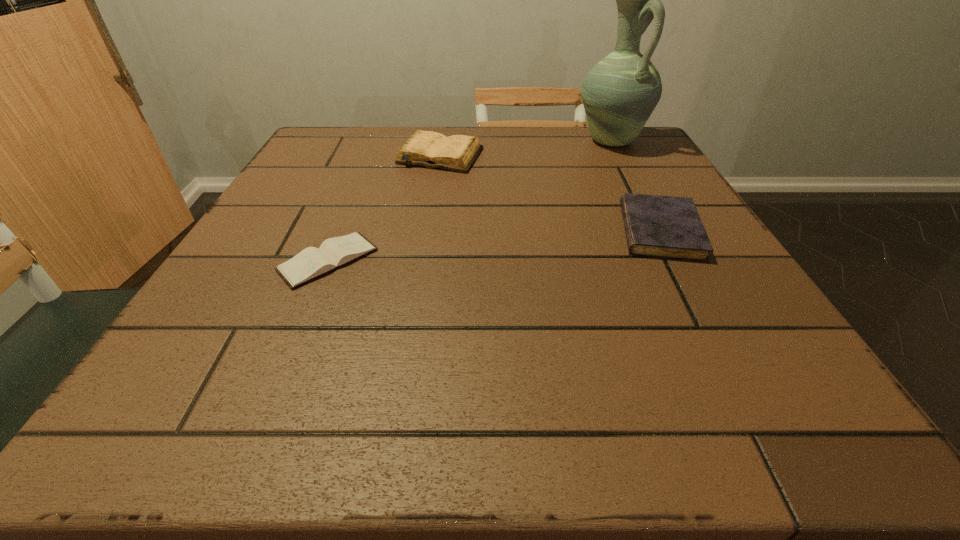
The image size is (960, 540). I want to click on vacant area between the shortest diary and the tallest diary, so click(x=384, y=208).

This screenshot has width=960, height=540. What are the coordinates of `vacant space in between the tallest diary and the pitcher` in the screenshot? It's located at (526, 148).

Image resolution: width=960 pixels, height=540 pixels. In order to click on blank region between the tallest object and the second shortest object in this screenshot , I will do `click(636, 186)`.

Select which object appears as the third closest to the shortest object. Please provide its 2D coordinates. Your answer should be formatted as a tuple, i.e. [(x, y)], where the tuple contains the x and y coordinates of a point satisfying the conditions above.

[(619, 93)]

Point out which object is positioned as the nearest to the shortest object. Please provide its 2D coordinates. Your answer should be formatted as a tuple, i.e. [(x, y)], where the tuple contains the x and y coordinates of a point satisfying the conditions above.

[(458, 153)]

Select which diary is the closest to the shortest object. Please provide its 2D coordinates. Your answer should be formatted as a tuple, i.e. [(x, y)], where the tuple contains the x and y coordinates of a point satisfying the conditions above.

[(458, 153)]

The height and width of the screenshot is (540, 960). Identify the location of diary that stands as the closest to the tallest diary. (310, 263).

Where is `free space that satisfies the following two spatial constraints: 1. on the handle side of the rightmost diary; 2. on the left side of the pitcher`? free space that satisfies the following two spatial constraints: 1. on the handle side of the rightmost diary; 2. on the left side of the pitcher is located at coordinates (659, 231).

Where is `free space that satisfies the following two spatial constraints: 1. on the handle side of the rightmost diary; 2. on the right side of the tallest object`? Image resolution: width=960 pixels, height=540 pixels. free space that satisfies the following two spatial constraints: 1. on the handle side of the rightmost diary; 2. on the right side of the tallest object is located at coordinates (659, 231).

This screenshot has width=960, height=540. What are the coordinates of `vacant space that satisfies the following two spatial constraints: 1. on the back side of the shortest diary; 2. on the right side of the tallest diary` in the screenshot? It's located at (372, 156).